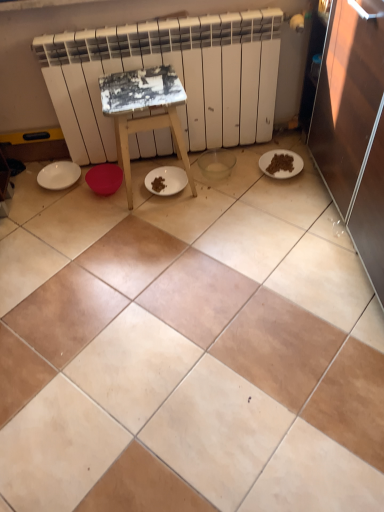
Question: Could you tell me if white painted wood stool at center is turned towards white matte plate at lower right, the 1th paper plate when ordered from right to left?

Choices:
 (A) yes
 (B) no

Answer: (B)

Question: Is white painted wood stool at center turned away from white matte plate at lower right, which is the 2th paper plate from left to right?

Choices:
 (A) no
 (B) yes

Answer: (A)

Question: Considering the relative positions of white painted wood stool at center and white matte plate at lower right, which is the 2th paper plate from left to right, in the image provided, is white painted wood stool at center to the right of white matte plate at lower right, which is the 2th paper plate from left to right, from the viewer's perspective?

Choices:
 (A) yes
 (B) no

Answer: (B)

Question: Is white painted wood stool at center wider than white matte plate at lower right, the 1th paper plate when ordered from right to left?

Choices:
 (A) yes
 (B) no

Answer: (A)

Question: Considering the relative sizes of white painted wood stool at center and white matte plate at lower right, which is the 2th paper plate from left to right, in the image provided, is white painted wood stool at center shorter than white matte plate at lower right, which is the 2th paper plate from left to right,?

Choices:
 (A) yes
 (B) no

Answer: (B)

Question: Considering the positions of white painted wood stool at center and white matte plate at left, the 2th paper plate viewed from the right, in the image, is white painted wood stool at center wider or thinner than white matte plate at left, the 2th paper plate viewed from the right,?

Choices:
 (A) wide
 (B) thin

Answer: (A)

Question: From the image's perspective, is white painted wood stool at center located above or below white matte plate at left, the 2th paper plate viewed from the right?

Choices:
 (A) above
 (B) below

Answer: (A)

Question: Considering their positions, is white painted wood stool at center located in front of or behind white matte plate at left, the 2th paper plate viewed from the right?

Choices:
 (A) front
 (B) behind

Answer: (A)

Question: From a real-world perspective, is white painted wood stool at center positioned above or below white matte plate at left, the 2th paper plate viewed from the right?

Choices:
 (A) below
 (B) above

Answer: (B)

Question: Is white painted wood stool at center in front of or behind beige ceramic tile at center in the image?

Choices:
 (A) behind
 (B) front

Answer: (A)

Question: In terms of size, does white painted wood stool at center appear bigger or smaller than beige ceramic tile at center?

Choices:
 (A) big
 (B) small

Answer: (B)

Question: From a real-world perspective, is white painted wood stool at center above or below beige ceramic tile at center?

Choices:
 (A) below
 (B) above

Answer: (B)

Question: From the image's perspective, is white painted wood stool at center located above or below beige ceramic tile at center?

Choices:
 (A) below
 (B) above

Answer: (B)

Question: Visually, is white matte radiator at upper center positioned to the left or to the right of beige ceramic tile at center?

Choices:
 (A) left
 (B) right

Answer: (A)

Question: Considering the positions of white matte radiator at upper center and beige ceramic tile at center in the image, is white matte radiator at upper center bigger or smaller than beige ceramic tile at center?

Choices:
 (A) small
 (B) big

Answer: (B)